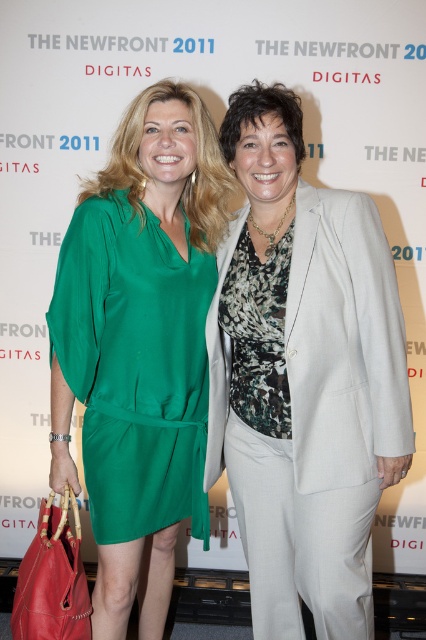
You are at a networking event and need to approach both the person in the green silk dress at left and the person in the light gray wool business suit at center. Which individual should you approach first to maintain proper social etiquette?

You should approach the person in the green silk dress at left first because the light gray wool business suit at center is positioned behind them, indicating they might be part of a conversation or group where interrupting could be less appropriate. Starting with the person in front maintains social etiquette by acknowledging their presence first.

You are a photographer adjusting your camera settings to focus on two specific points in the image. The first point is at coordinates point (163, 438) and the second is at point (388, 310). Which point should you focus on first if you want to ensure the closest object is in focus?

Point (163, 438) is further to the camera than point (388, 310), so you should focus on point (163, 438) first to ensure the closest object is in focus.